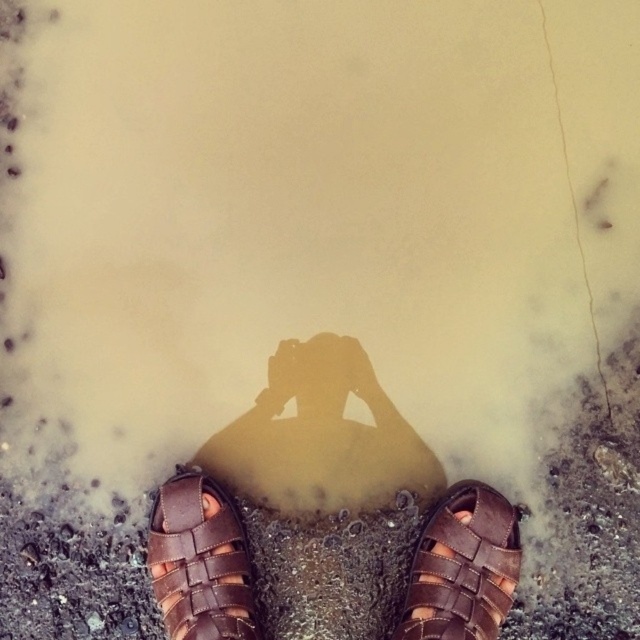
Question: Is brown leather sandal at lower left wider than brown leather sandal at lower center?

Choices:
 (A) yes
 (B) no

Answer: (B)

Question: Is brown leather sandals at lower center thinner than brown leather sandal at lower center?

Choices:
 (A) yes
 (B) no

Answer: (B)

Question: Which object is positioned farthest from the brown leather sandal at lower center?

Choices:
 (A) brown leather sandals at lower center
 (B) brown leather sandal at lower left

Answer: (B)

Question: Which of the following is the closest to the observer?

Choices:
 (A) brown leather sandals at lower center
 (B) brown leather sandal at lower center

Answer: (B)

Question: Is brown leather sandals at lower center smaller than brown leather sandal at lower center?

Choices:
 (A) no
 (B) yes

Answer: (A)

Question: Which of the following is the closest to the observer?

Choices:
 (A) (442, 563)
 (B) (252, 452)
 (C) (173, 481)

Answer: (A)